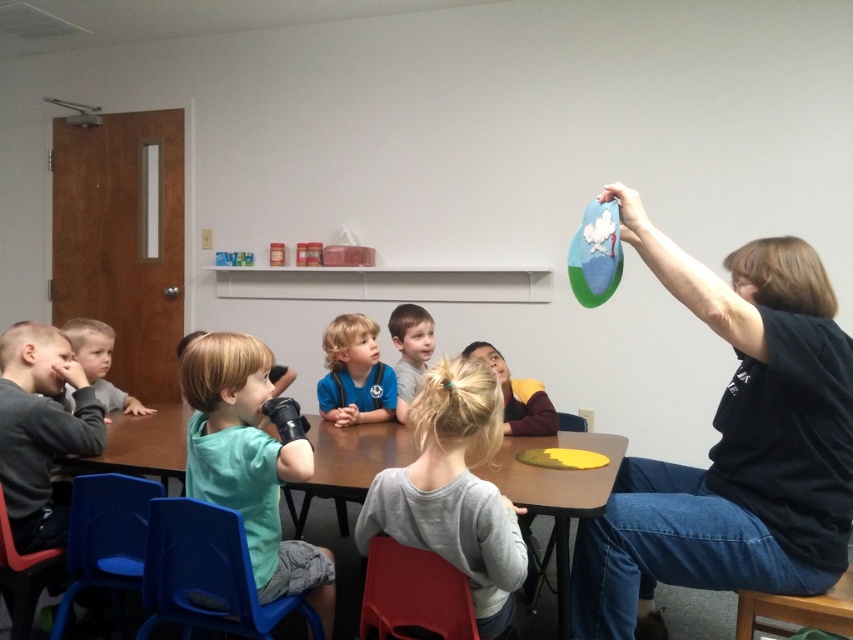
You are standing at the point with coordinates point (187, 378) and want to move to the door on the left side of the classroom. Is the point point (347, 381) blocking your path?

Point (187, 378) is in front of point (347, 381), so the point point (347, 381) is behind and not blocking your path.

You are standing at point (x=68, y=336) and want to walk to the door on the left. Is the point (x=366, y=376) in front of or behind you as you face the door?

The point (x=366, y=376) is behind you as you face the door because it is behind point (x=68, y=336).